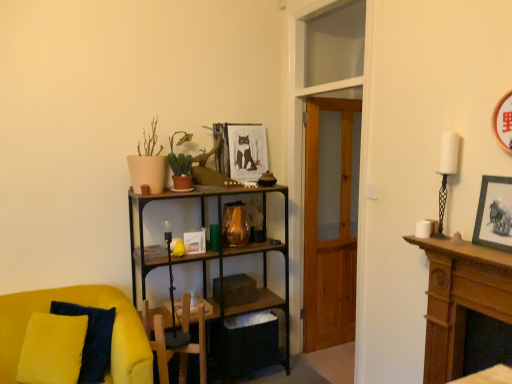
Question: Is green matte cactus at upper center, which is counted as the second houseplant, starting from the front, turned away from matte black picture frame at upper right, the second picture frame in the top-to-bottom sequence?

Choices:
 (A) yes
 (B) no

Answer: (B)

Question: Does green matte cactus at upper center, marked as the 1th houseplant in a back-to-front arrangement, have a lesser width compared to matte black picture frame at upper right, acting as the first picture frame starting from the right?

Choices:
 (A) no
 (B) yes

Answer: (A)

Question: Does green matte cactus at upper center, marked as the 1th houseplant in a back-to-front arrangement, turn towards matte black picture frame at upper right, acting as the first picture frame starting from the right?

Choices:
 (A) no
 (B) yes

Answer: (A)

Question: Does green matte cactus at upper center, which is counted as the second houseplant, starting from the front, have a greater height compared to matte black picture frame at upper right, which appears as the first picture frame when viewed from the front?

Choices:
 (A) no
 (B) yes

Answer: (B)

Question: Is green matte cactus at upper center, which is counted as the second houseplant, starting from the front, to the left of matte black picture frame at upper right, placed as the 2th picture frame when sorted from left to right, from the viewer's perspective?

Choices:
 (A) yes
 (B) no

Answer: (A)

Question: Is green matte cactus at upper center, which is counted as the second houseplant, starting from the front, located outside matte black picture frame at upper right, placed as the 2th picture frame when sorted from left to right?

Choices:
 (A) no
 (B) yes

Answer: (B)

Question: Is wooden framed picture at center, marked as the second picture frame in a right-to-left arrangement, at the left side of velvet yellow armchair at lower left?

Choices:
 (A) no
 (B) yes

Answer: (A)

Question: Considering the relative positions of wooden framed picture at center, marked as the 2th picture frame in a front-to-back arrangement, and velvet yellow armchair at lower left in the image provided, is wooden framed picture at center, marked as the 2th picture frame in a front-to-back arrangement, to the right of velvet yellow armchair at lower left from the viewer's perspective?

Choices:
 (A) yes
 (B) no

Answer: (A)

Question: Is wooden framed picture at center, positioned as the first picture frame in back-to-front order, smaller than velvet yellow armchair at lower left?

Choices:
 (A) yes
 (B) no

Answer: (A)

Question: Can you confirm if wooden framed picture at center, marked as the 2th picture frame in a front-to-back arrangement, is shorter than velvet yellow armchair at lower left?

Choices:
 (A) no
 (B) yes

Answer: (B)

Question: Can velvet yellow armchair at lower left be found inside wooden framed picture at center, the 2th picture frame from the bottom?

Choices:
 (A) yes
 (B) no

Answer: (B)

Question: Is wooden framed picture at center, the 1th picture frame when ordered from left to right, closer to the viewer compared to velvet yellow armchair at lower left?

Choices:
 (A) yes
 (B) no

Answer: (B)

Question: Is wooden framed picture at center, marked as the 2th picture frame in a front-to-back arrangement, further to the viewer compared to green matte cactus at upper center, which is counted as the second houseplant, starting from the front?

Choices:
 (A) yes
 (B) no

Answer: (A)